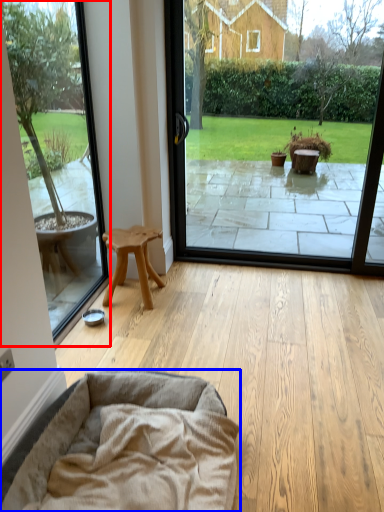
Question: Which point is further to the camera, window screen (highlighted by a red box) or dog bed (highlighted by a blue box)?

Choices:
 (A) window screen
 (B) dog bed

Answer: (A)